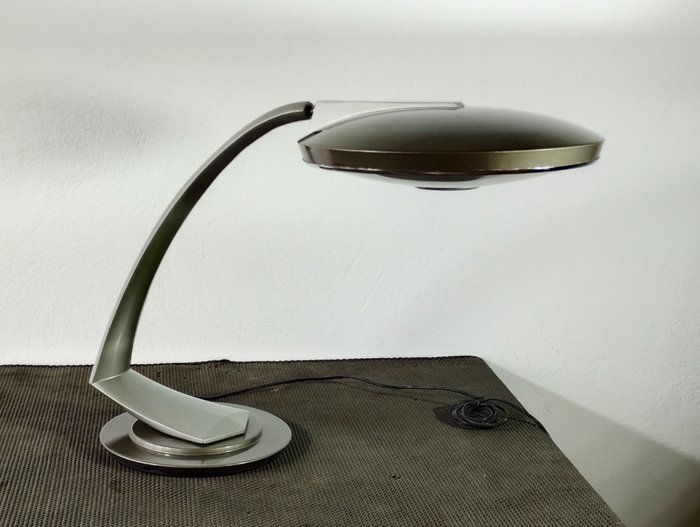
This screenshot has height=527, width=700. In order to click on lamp stand in this screenshot , I will do pyautogui.click(x=178, y=440).